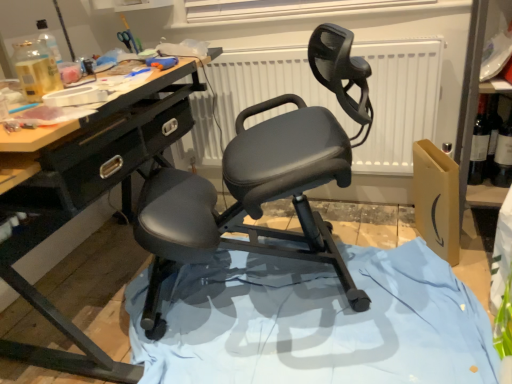
Question: Does matte black ergonomic chair at center have a larger size compared to blue fabric at center?

Choices:
 (A) yes
 (B) no

Answer: (A)

Question: Is matte black ergonomic chair at center further to camera compared to blue fabric at center?

Choices:
 (A) no
 (B) yes

Answer: (A)

Question: Is blue fabric at center located within matte black ergonomic chair at center?

Choices:
 (A) no
 (B) yes

Answer: (B)

Question: Is matte black ergonomic chair at center placed right next to blue fabric at center?

Choices:
 (A) no
 (B) yes

Answer: (A)

Question: From the image's perspective, is matte black ergonomic chair at center below blue fabric at center?

Choices:
 (A) yes
 (B) no

Answer: (B)

Question: Looking at their shapes, would you say white matte radiator at center is wider or thinner than white matte window screen at upper center?

Choices:
 (A) wide
 (B) thin

Answer: (A)

Question: Is white matte radiator at center situated inside white matte window screen at upper center or outside?

Choices:
 (A) inside
 (B) outside

Answer: (B)

Question: From the image's perspective, is white matte radiator at center located above or below white matte window screen at upper center?

Choices:
 (A) above
 (B) below

Answer: (B)

Question: Looking at the image, does white matte radiator at center seem bigger or smaller compared to white matte window screen at upper center?

Choices:
 (A) big
 (B) small

Answer: (A)

Question: In the image, is blue fabric at center on the left side or the right side of dark glass wine bottle at right?

Choices:
 (A) left
 (B) right

Answer: (A)

Question: From a real-world perspective, is blue fabric at center positioned above or below dark glass wine bottle at right?

Choices:
 (A) below
 (B) above

Answer: (A)

Question: From the image's perspective, is blue fabric at center located above or below dark glass wine bottle at right?

Choices:
 (A) below
 (B) above

Answer: (A)

Question: Relative to dark glass wine bottle at right, is blue fabric at center in front or behind?

Choices:
 (A) behind
 (B) front

Answer: (B)

Question: From the image's perspective, is blue fabric at center positioned above or below matte black ergonomic chair at center?

Choices:
 (A) below
 (B) above

Answer: (A)

Question: In the image, is blue fabric at center positioned in front of or behind matte black ergonomic chair at center?

Choices:
 (A) front
 (B) behind

Answer: (B)